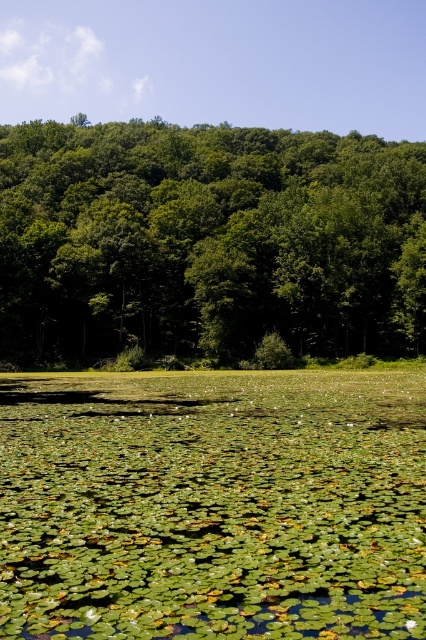
You are standing at the edge of the water body in the scene. Which of the two objects, the green leafy water at center or the green leafy trees at upper center, is closer to you?

The green leafy water at center is closer to you because it is positioned below the green leafy trees at upper center, indicating it is in the foreground.

You are standing at the edge of the water body in the scene. If you want to reach the green leafy water at center, in which direction should you walk?

You should walk towards the center of the water body to reach the green leafy water at center, as it is located at point 0.791 on the x axis and 0.500 on the y axis.

You are a bird flying over the serene natural scene. You see the green leafy water at center and the green leafy trees at upper center. Which one appears larger in size?

The green leafy trees at upper center are larger in size compared to the green leafy water at center.